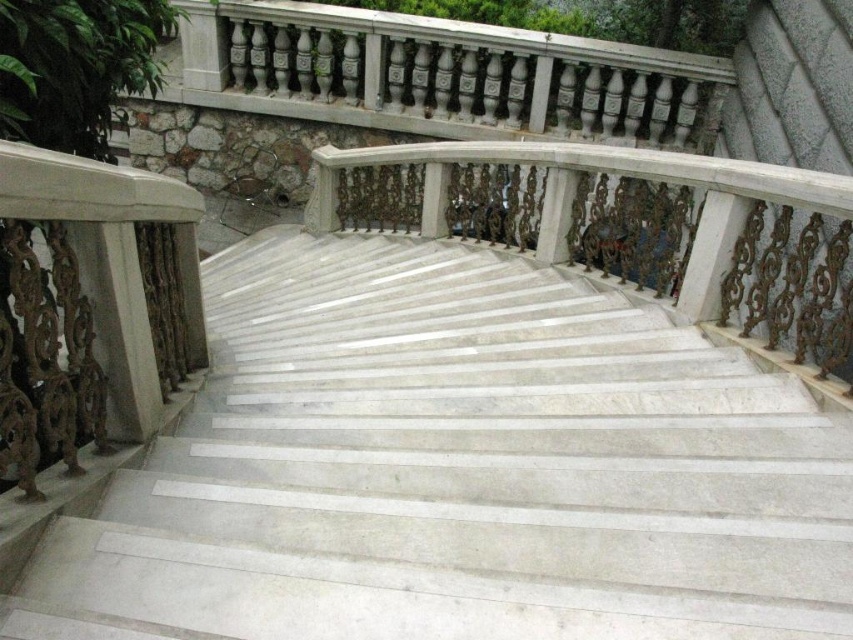
Between white marble stairs at center and white marble balustrade at center, which one has more height?

white marble balustrade at center is taller.

Where is `white marble stairs at center`? This screenshot has width=853, height=640. white marble stairs at center is located at coordinates (459, 468).